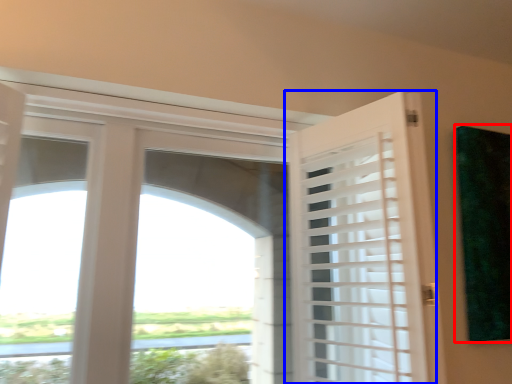
Question: Among these objects, which one is farthest to the camera, window screen (highlighted by a red box) or door (highlighted by a blue box)?

Choices:
 (A) window screen
 (B) door

Answer: (A)